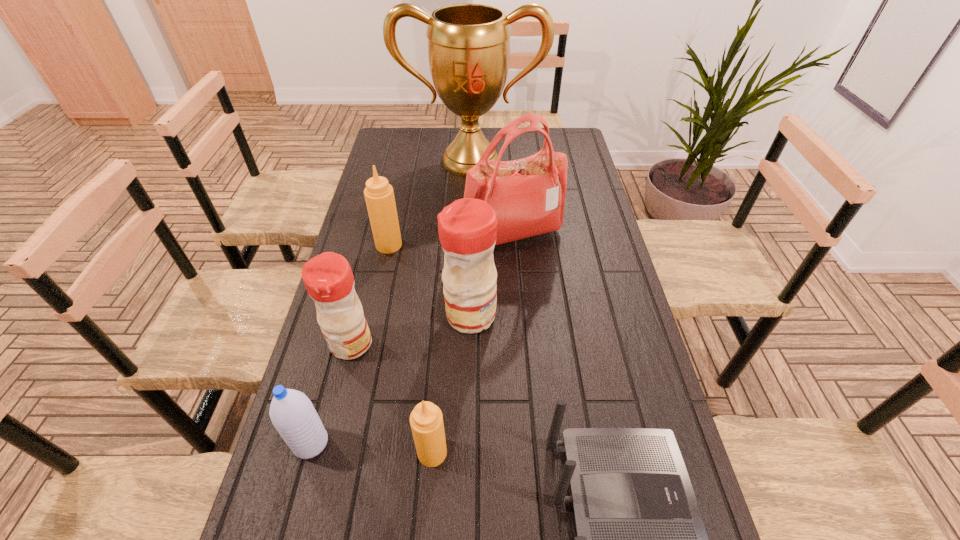
The width and height of the screenshot is (960, 540). In order to click on the right tan condiment in this screenshot , I will do `click(426, 420)`.

Image resolution: width=960 pixels, height=540 pixels. In order to click on the nearer tan condiment in this screenshot , I will do `click(426, 420)`.

At what (x,y) coordinates should I click in order to perform the action: click on free space located on the surface of the farthest object with symbols. Please return your answer as a coordinate pair (x, y). This screenshot has height=540, width=960. Looking at the image, I should click on (468, 239).

At what (x,y) coordinates should I click in order to perform the action: click on vacant space located 0.290m on the front-facing side of the red handbag. Please return your answer as a coordinate pair (x, y). Looking at the image, I should click on (x=519, y=332).

At what (x,y) coordinates should I click in order to perform the action: click on free region located on the left of the bigger red condiment. Please return your answer as a coordinate pair (x, y). Looking at the image, I should click on (399, 315).

Where is `vacant space located 0.340m on the front of the left tan condiment`? vacant space located 0.340m on the front of the left tan condiment is located at coordinates tap(369, 340).

At what (x,y) coordinates should I click in order to perform the action: click on vacant position located on the right of the left red condiment. Please return your answer as a coordinate pair (x, y). Looking at the image, I should click on (488, 344).

You are a GUI agent. You are given a task and a screenshot of the screen. Output one action in this format:
    pyautogui.click(x=<x>, y=<y>)
    Task: Click on the free space located on the back of the water bottle
    
    Given the screenshot: What is the action you would take?
    pyautogui.click(x=324, y=395)

I want to click on free space located 0.330m on the back of the nearer tan condiment, so click(442, 323).

Where is `object that is at the far edge`? This screenshot has height=540, width=960. object that is at the far edge is located at coordinates (468, 44).